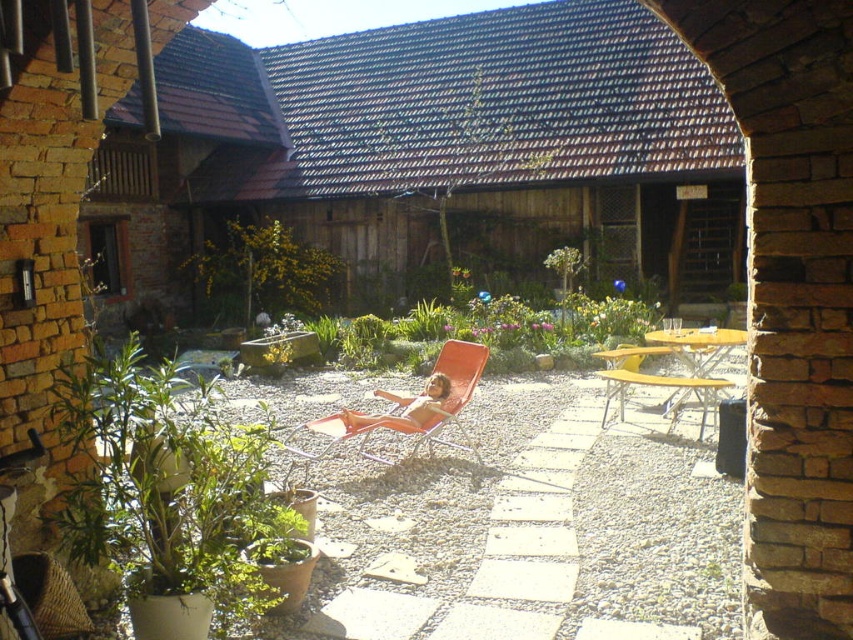
Question: Which point appears closest to the camera in this image?

Choices:
 (A) (442, 362)
 (B) (474, 308)

Answer: (A)

Question: Does green leafy plant at lower left come in front of green leafy plant at center?

Choices:
 (A) yes
 (B) no

Answer: (A)

Question: Among these objects, which one is nearest to the camera?

Choices:
 (A) green leafy plant at center
 (B) green leafy plant at lower left
 (C) orange mesh beach chair at center

Answer: (B)

Question: Can you confirm if orange mesh beach chair at center is positioned above yellow plastic beach chair at center?

Choices:
 (A) no
 (B) yes

Answer: (A)

Question: Is green leafy plant at center positioned at the back of yellow-green leaves at center?

Choices:
 (A) yes
 (B) no

Answer: (B)

Question: Among these objects, which one is farthest from the camera?

Choices:
 (A) yellow plastic beach chair at center
 (B) green leafy plant at center
 (C) yellow-green leaves at center

Answer: (C)